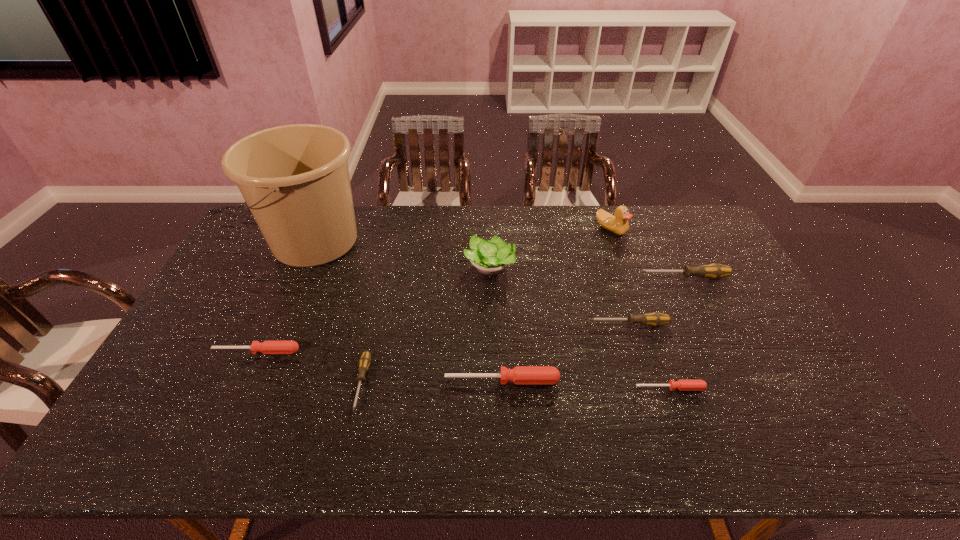
Find the location of `vacant space situated on the left of the seventh shortest object`. vacant space situated on the left of the seventh shortest object is located at coordinates (445, 268).

At what (x,y) coordinates should I click in order to perform the action: click on free space located 0.250m at the tip of the fourth tallest object. Please return your answer as a coordinate pair (x, y). The height and width of the screenshot is (540, 960). Looking at the image, I should click on (562, 278).

In order to click on vacant space located 0.130m at the tip of the fourth tallest object in this screenshot , I will do `click(598, 278)`.

Where is `vacant area located at the tip of the fourth tallest object`? The image size is (960, 540). vacant area located at the tip of the fourth tallest object is located at coordinates (538, 278).

At what (x,y) coordinates should I click in order to perform the action: click on vacant space located at the tip of the second farthest screwdriver. Please return your answer as a coordinate pair (x, y). The height and width of the screenshot is (540, 960). Looking at the image, I should click on (472, 324).

Locate an element on the screen. vacant space located 0.380m at the tip of the second farthest screwdriver is located at coordinates (459, 324).

The image size is (960, 540). I want to click on vacant space located 0.140m at the tip of the second farthest screwdriver, so click(x=540, y=324).

Locate an element on the screen. This screenshot has height=540, width=960. vacant space located on the right of the biggest red screwdriver is located at coordinates (655, 380).

This screenshot has width=960, height=540. Find the location of `vacant space located 0.070m on the right of the leftmost screwdriver`. vacant space located 0.070m on the right of the leftmost screwdriver is located at coordinates (324, 351).

Identify the location of vacant space positioned at the tip of the nearest gray screwdriver. (346, 454).